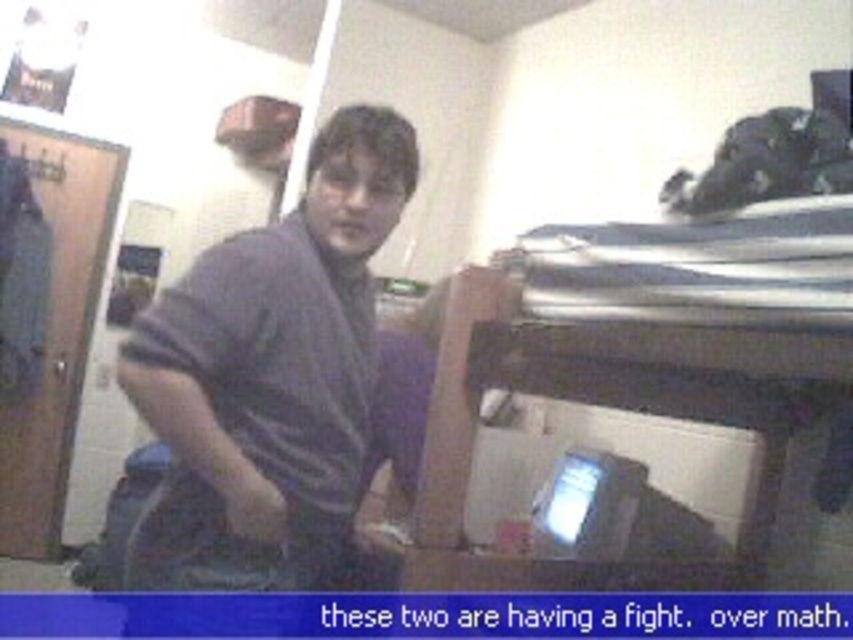
Does metallic silver bunk bed at right come behind dark gray cotton shirt at center?

No, metallic silver bunk bed at right is closer to the viewer.

Is point (828, 538) in front of point (320, 284)?

No, it is not.

Who is more forward, [755,387] or [231,381]?

Positioned in front is point [231,381].

At what (x,y) coordinates should I click in order to perform the action: click on metallic silver bunk bed at right. Please return your answer as a coordinate pair (x, y). The height and width of the screenshot is (640, 853). Looking at the image, I should click on (650, 401).